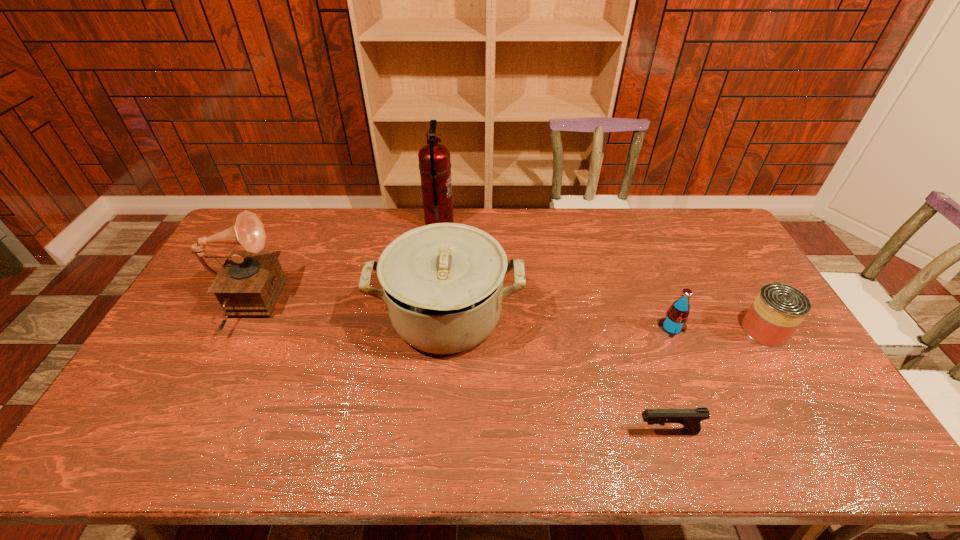
I want to click on free spot located 0.140m on the horn of the second tallest object, so click(325, 307).

At what (x,y) coordinates should I click in order to perform the action: click on free space located on the back of the third tallest object. Please return your answer as a coordinate pair (x, y). Image resolution: width=960 pixels, height=540 pixels. Looking at the image, I should click on (453, 218).

The image size is (960, 540). What are the coordinates of `blank space located on the front of the soda` in the screenshot? It's located at (687, 367).

The width and height of the screenshot is (960, 540). In order to click on blank space located 0.180m on the front of the rightmost object in this screenshot , I will do `click(808, 404)`.

This screenshot has height=540, width=960. What are the coordinates of `free space located 0.190m at the barrel of the pistol` in the screenshot? It's located at (559, 431).

The image size is (960, 540). What are the coordinates of `free space located 0.350m at the barrel of the pistol` in the screenshot? It's located at (493, 431).

Where is `blank space located 0.280m at the barrel of the pistol`? blank space located 0.280m at the barrel of the pistol is located at coordinates (521, 431).

What are the coordinates of `object located at the far edge` in the screenshot? It's located at (434, 159).

Where is `object located in the near edge section of the desktop`? object located in the near edge section of the desktop is located at coordinates (690, 418).

Where is `object at the left edge`? The width and height of the screenshot is (960, 540). object at the left edge is located at coordinates tap(249, 283).